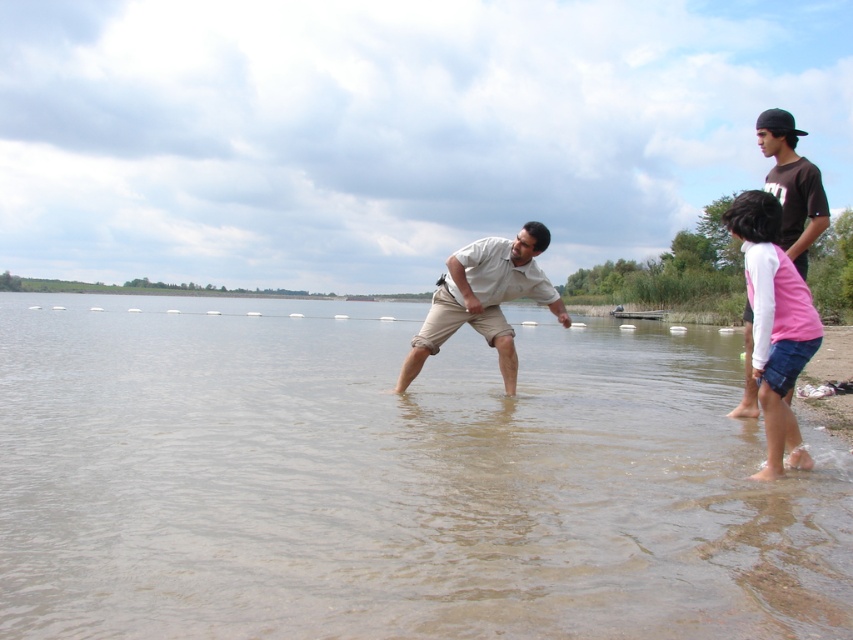
Does clear water at center have a greater width compared to beige cotton shirt at center?

Yes.

Looking at this image, which is below, clear water at center or beige cotton shirt at center?

clear water at center

What are the coordinates of `clear water at center` in the screenshot? It's located at (393, 481).

Which is more to the right, clear water at center or pink fabric shorts at lower right?

Positioned to the right is pink fabric shorts at lower right.

Does clear water at center appear over pink fabric shorts at lower right?

Actually, clear water at center is below pink fabric shorts at lower right.

Is point (422, 625) positioned after point (769, 344)?

That is False.

The width and height of the screenshot is (853, 640). I want to click on clear water at center, so click(393, 481).

Does pink fabric shorts at lower right appear on the left side of beige cotton shirt at center?

In fact, pink fabric shorts at lower right is to the right of beige cotton shirt at center.

What do you see at coordinates (775, 323) in the screenshot?
I see `pink fabric shorts at lower right` at bounding box center [775, 323].

At what (x,y) coordinates should I click in order to perform the action: click on pink fabric shorts at lower right. Please return your answer as a coordinate pair (x, y). The height and width of the screenshot is (640, 853). Looking at the image, I should click on (775, 323).